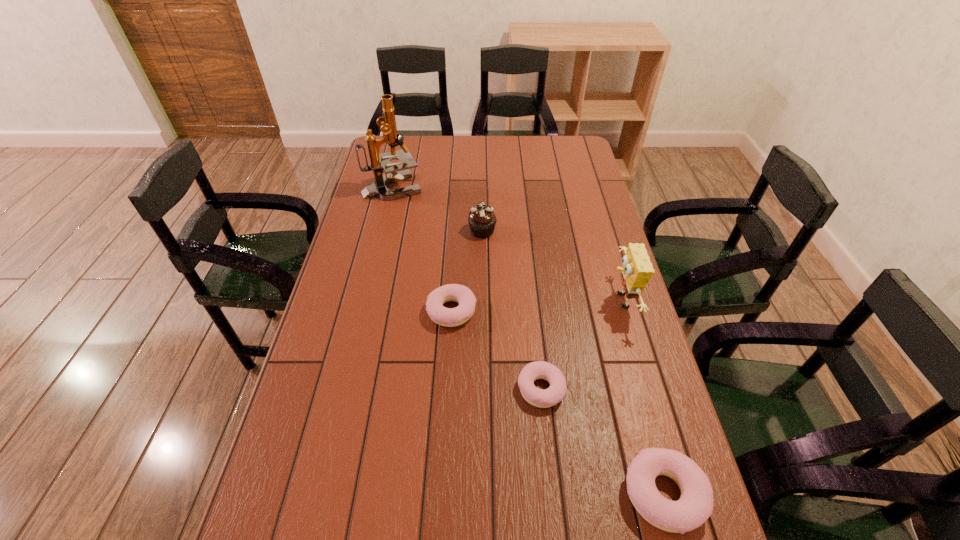
Where is `vacant space that's between the leftmost doughnut and the fifth nearest object`? This screenshot has width=960, height=540. vacant space that's between the leftmost doughnut and the fifth nearest object is located at coordinates (468, 271).

The height and width of the screenshot is (540, 960). Find the location of `vacant space that is in between the sponge and the fifth nearest object`. vacant space that is in between the sponge and the fifth nearest object is located at coordinates (x=551, y=266).

This screenshot has height=540, width=960. I want to click on free space between the rightmost doughnut and the tallest object, so pos(528,341).

Identify the location of empty location between the second tallest object and the second doughnut from right to left. The image size is (960, 540). (581, 345).

Where is `free space between the fifth tallest object and the cupcake`? free space between the fifth tallest object and the cupcake is located at coordinates (468, 271).

At what (x,y) coordinates should I click in order to perform the action: click on vacant point located between the shortest doughnut and the fifth shortest object. Please return your answer as a coordinate pair (x, y). This screenshot has width=960, height=540. Looking at the image, I should click on (581, 345).

Locate an element on the screen. The height and width of the screenshot is (540, 960). object that is the fourth closest to the second tallest doughnut is located at coordinates (695, 506).

Locate an element on the screen. This screenshot has width=960, height=540. object that is the fifth closest one to the leftmost object is located at coordinates (695, 506).

Locate an element on the screen. The width and height of the screenshot is (960, 540). doughnut identified as the second closest to the rightmost doughnut is located at coordinates (449, 317).

Identify which doughnut is the closest to the farthest object. Please provide its 2D coordinates. Your answer should be formatted as a tuple, i.e. [(x, y)], where the tuple contains the x and y coordinates of a point satisfying the conditions above.

[(449, 317)]